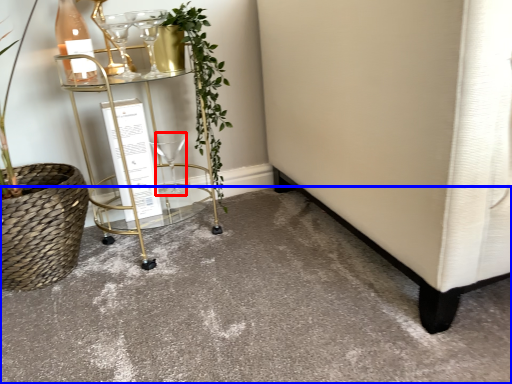
Question: Which object is further to the camera taking this photo, wine glass (highlighted by a red box) or concrete (highlighted by a blue box)?

Choices:
 (A) wine glass
 (B) concrete

Answer: (A)